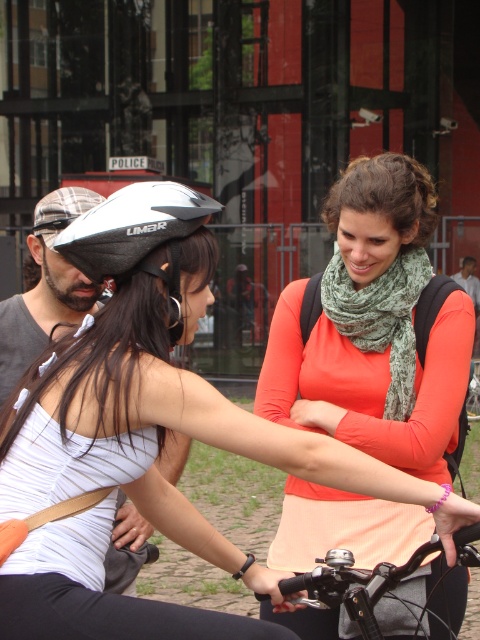
Does bearded man at center have a greater width compared to dark gray fabric shirt at center?

Yes.

Does bearded man at center have a lesser height compared to dark gray fabric shirt at center?

No.

Is point (58, 333) less distant than point (467, 259)?

Yes, it is.

What are the coordinates of `bearded man at center` in the screenshot? It's located at (46, 289).

Can you confirm if green textured scarf at center is shorter than silver matte bicycle helmet at center?

No, green textured scarf at center is not shorter than silver matte bicycle helmet at center.

Identify the location of green textured scarf at center. This screenshot has height=640, width=480. (381, 317).

Is white matte helmet at upper left thinner than metallic silver handlebars at center?

In fact, white matte helmet at upper left might be wider than metallic silver handlebars at center.

At what (x,y) coordinates should I click in order to perform the action: click on white matte helmet at upper left. Please return your answer as a coordinate pair (x, y). Looking at the image, I should click on (146, 436).